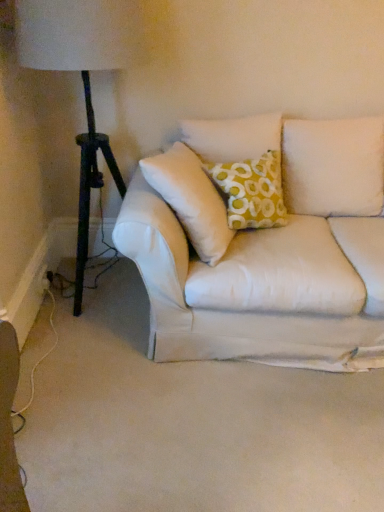
This screenshot has height=512, width=384. Describe the element at coordinates (44, 279) in the screenshot. I see `white plastic electric outlet at lower left` at that location.

In order to face white plastic electric outlet at lower left, should I rotate leftwards or rightwards?

To align with it, rotate left about 18.734°.

Locate an element on the screen. The height and width of the screenshot is (512, 384). white plastic electric outlet at lower left is located at coordinates (44, 279).

This screenshot has width=384, height=512. In order to click on white plastic electric outlet at lower left in this screenshot , I will do `click(44, 279)`.